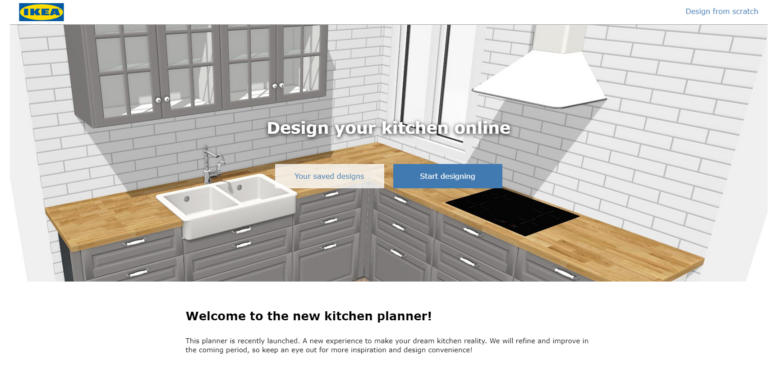
The height and width of the screenshot is (382, 768). I want to click on drawer handles below sink, so click(245, 231), click(245, 243).